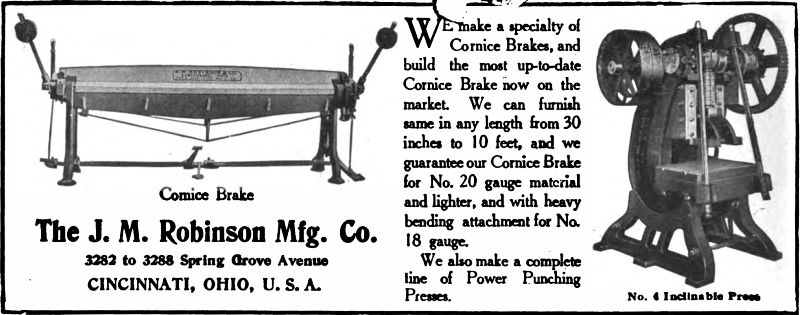
I want to click on stand, so click(x=694, y=256), click(x=326, y=145), click(x=156, y=162), click(x=70, y=131), click(x=749, y=231).